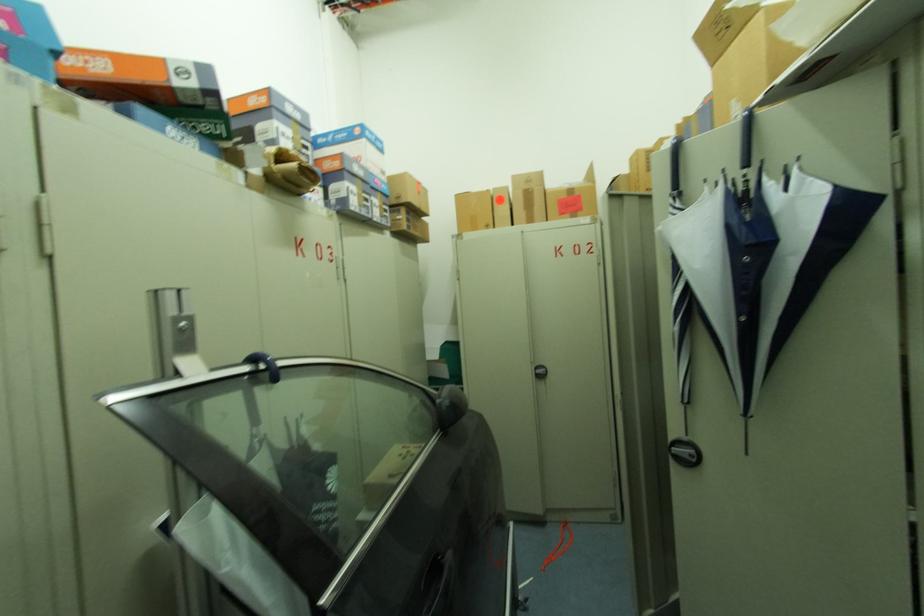
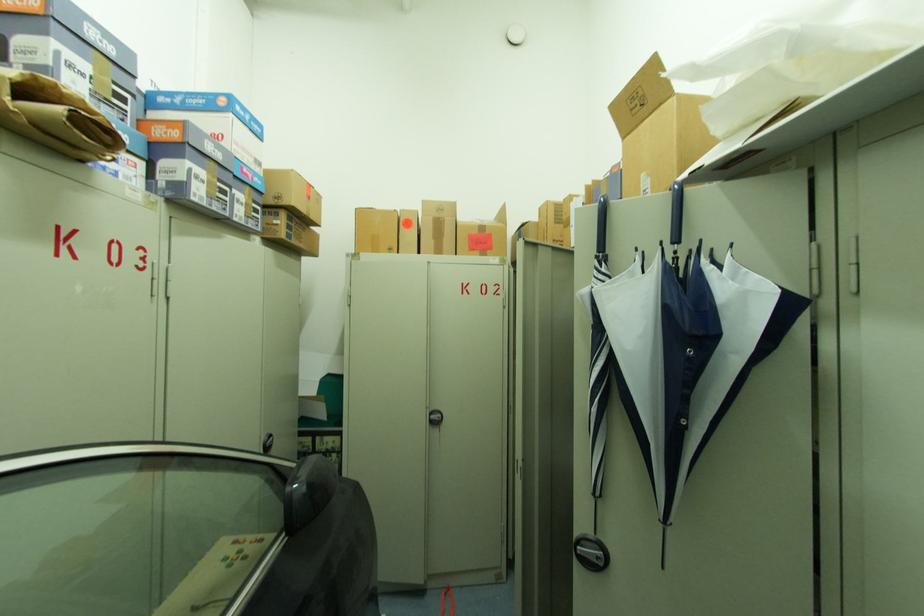
Question: The camera is either moving clockwise (left) or counter-clockwise (right) around the object. The first image is from the beginning of the video and the second image is from the end. Is the camera moving left or right when shooting the video?

Choices:
 (A) Left
 (B) Right

Answer: (A)